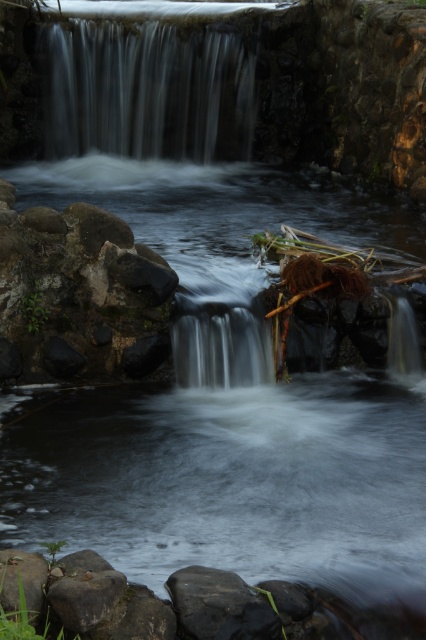
Question: Among these points, which one is nearest to the camera?

Choices:
 (A) (109, 84)
 (B) (46, 568)
 (C) (207, 349)

Answer: (B)

Question: Which object is positioned farthest from the smooth gray rock at lower left?

Choices:
 (A) smooth gray water at upper center
 (B) smooth gray water at center

Answer: (A)

Question: Can you confirm if smooth gray water at center is thinner than smooth gray rock at lower left?

Choices:
 (A) no
 (B) yes

Answer: (A)

Question: Is smooth gray water at upper center wider than smooth gray rock at lower left?

Choices:
 (A) yes
 (B) no

Answer: (A)

Question: Based on their relative distances, which object is farther from the smooth gray water at upper center?

Choices:
 (A) smooth gray rock at lower left
 (B) smooth gray water at center

Answer: (A)

Question: Observing the image, what is the correct spatial positioning of smooth gray water at upper center in reference to smooth gray rock at lower left?

Choices:
 (A) below
 (B) above

Answer: (B)